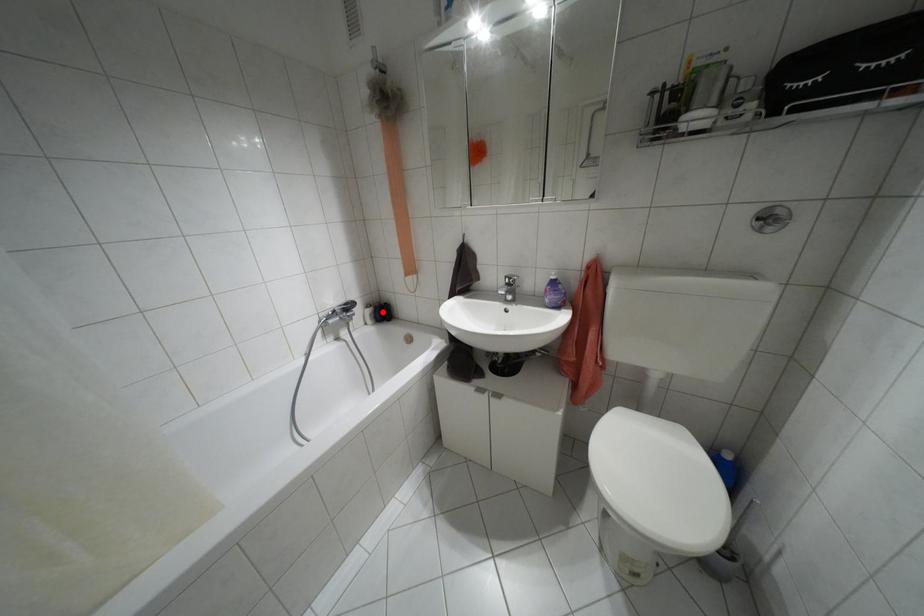
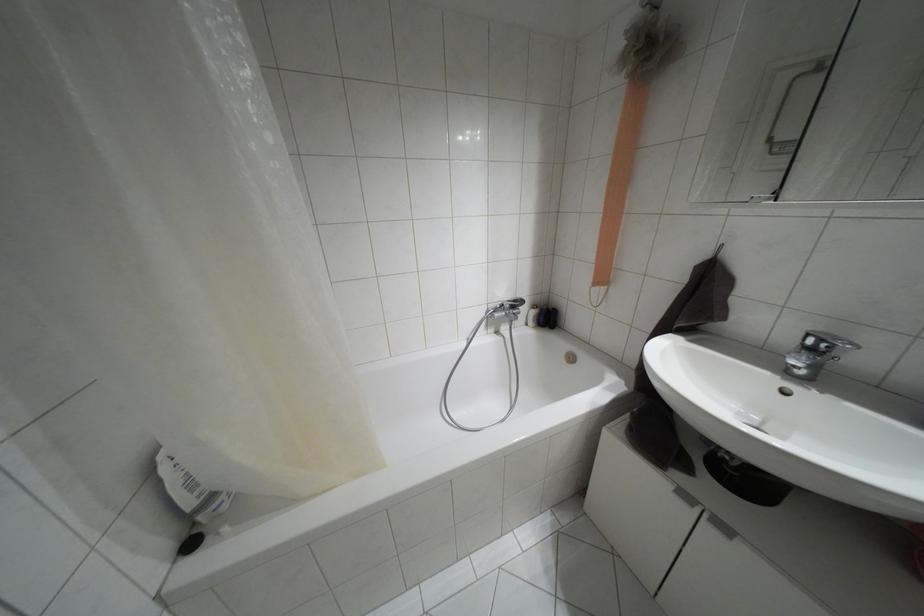
Where in the second image is the point corresponding to the highlighted location from the first image?

(546, 317)